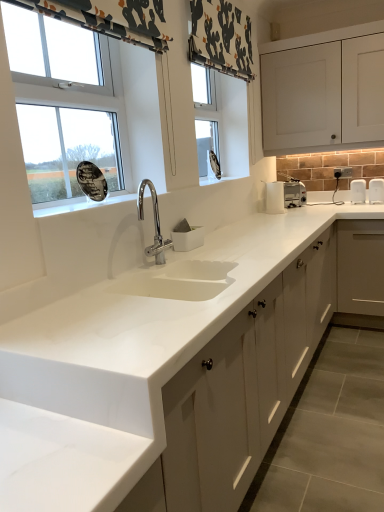
Question: Considering their positions, is patterned fabric curtain at upper left located in front of or behind white matte cabinet at upper right, which appears as the second cabinetry when ordered from the bottom?

Choices:
 (A) behind
 (B) front

Answer: (B)

Question: Based on their sizes in the image, would you say patterned fabric curtain at upper left is bigger or smaller than white matte cabinet at upper right, which appears as the second cabinetry when ordered from the bottom?

Choices:
 (A) small
 (B) big

Answer: (A)

Question: Which object is the farthest from the white matte cabinet at upper right, which appears as the second cabinetry when ordered from the bottom?

Choices:
 (A) white glossy window at upper left
 (B) white matte cabinet at center, placed as the 1th cabinetry when sorted from bottom to top
 (C) patterned fabric curtain at upper left

Answer: (A)

Question: Considering the real-world distances, which object is closest to the white glossy window at upper left?

Choices:
 (A) white matte cabinet at center, placed as the 1th cabinetry when sorted from bottom to top
 (B) patterned fabric curtain at upper left
 (C) white matte cabinet at upper right, which appears as the second cabinetry when ordered from the bottom

Answer: (B)